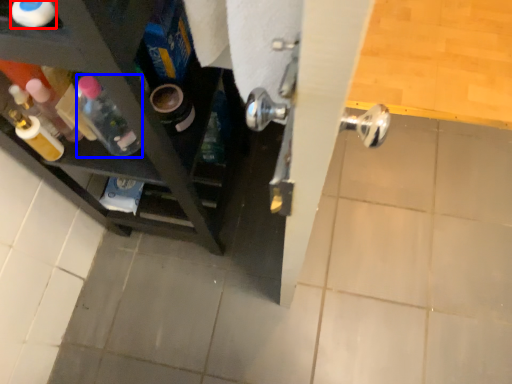
Question: Which object is closer to the camera taking this photo, bottle (highlighted by a red box) or bottle (highlighted by a blue box)?

Choices:
 (A) bottle
 (B) bottle

Answer: (A)